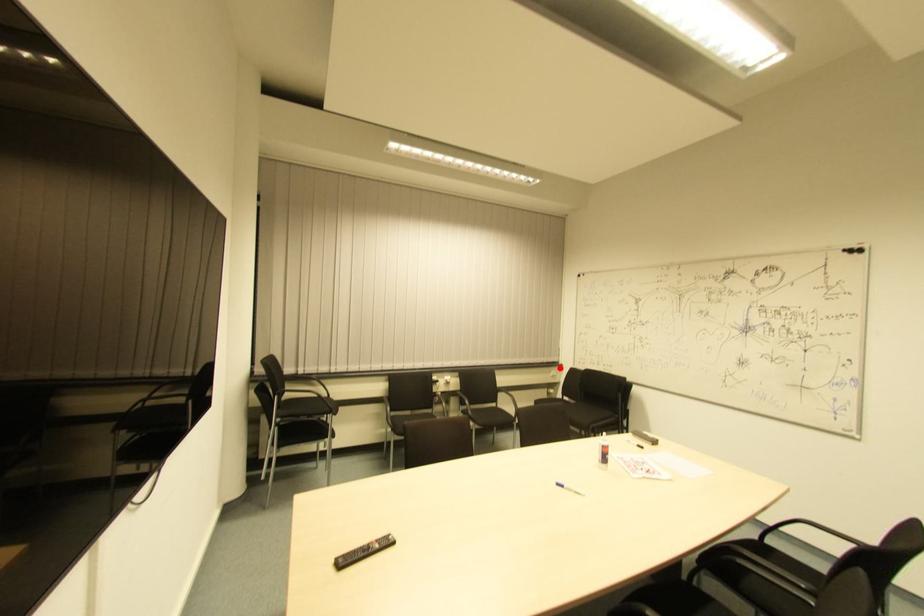
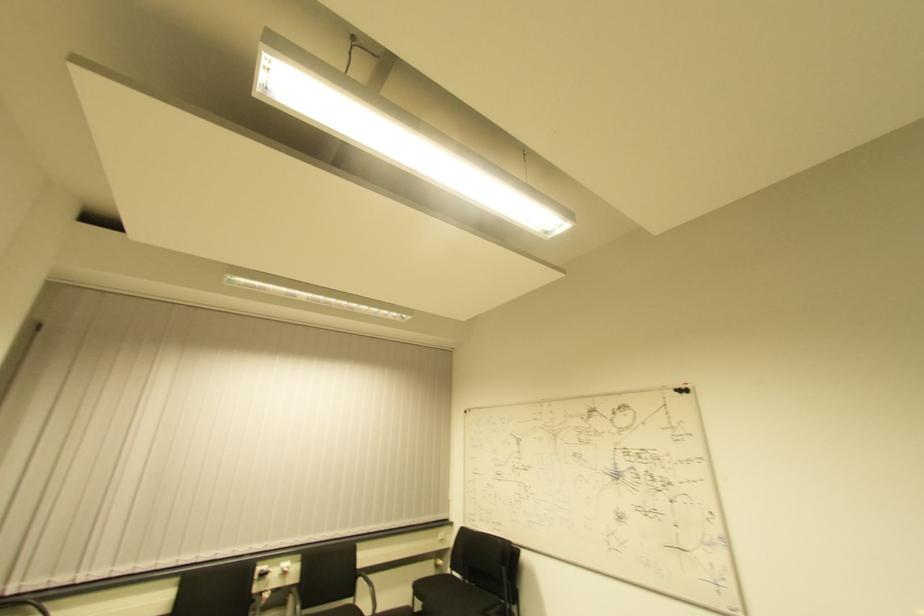
Question: I am providing you with two images of the same scene from different viewpoints. In image1, a red point is highlighted. Considering the same 3D point in image2, which of the following is correct?

Choices:
 (A) It is closer
 (B) It is farther

Answer: (B)